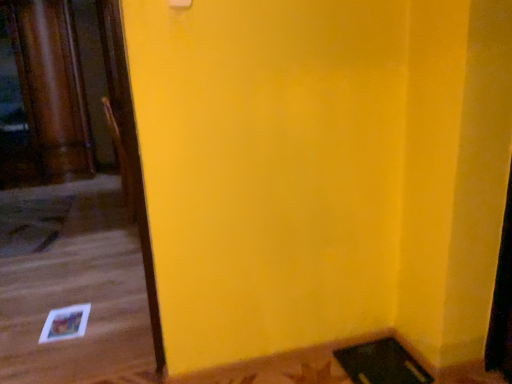
Question: From a real-world perspective, is rug at lower left on top of wooden chair at left?

Choices:
 (A) no
 (B) yes

Answer: (A)

Question: Does rug at lower left lie in front of wooden chair at left?

Choices:
 (A) no
 (B) yes

Answer: (B)

Question: Is there a large distance between rug at lower left and wooden chair at left?

Choices:
 (A) no
 (B) yes

Answer: (B)

Question: Can you confirm if rug at lower left is smaller than wooden chair at left?

Choices:
 (A) yes
 (B) no

Answer: (A)

Question: Can you confirm if rug at lower left is thinner than wooden chair at left?

Choices:
 (A) yes
 (B) no

Answer: (B)

Question: Does rug at lower left have a greater width compared to wooden chair at left?

Choices:
 (A) no
 (B) yes

Answer: (B)

Question: Is wooden chair at left far from rug at lower left?

Choices:
 (A) no
 (B) yes

Answer: (B)

Question: Can you see wooden chair at left touching rug at lower left?

Choices:
 (A) yes
 (B) no

Answer: (B)

Question: Is wooden chair at left to the left of rug at lower left from the viewer's perspective?

Choices:
 (A) no
 (B) yes

Answer: (A)

Question: Is wooden chair at left smaller than rug at lower left?

Choices:
 (A) no
 (B) yes

Answer: (A)

Question: Does wooden chair at left have a greater width compared to rug at lower left?

Choices:
 (A) yes
 (B) no

Answer: (B)

Question: Considering the relative sizes of wooden chair at left and rug at lower left in the image provided, is wooden chair at left shorter than rug at lower left?

Choices:
 (A) yes
 (B) no

Answer: (B)

Question: Considering the positions of rug at lower left and wooden chair at left in the image, is rug at lower left wider or thinner than wooden chair at left?

Choices:
 (A) thin
 (B) wide

Answer: (B)